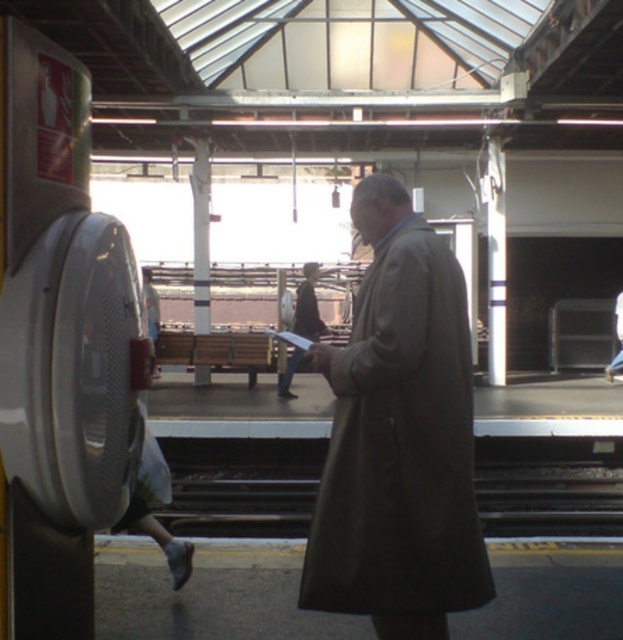
Is brown matte trench coat at center taller than dark gray metal train track at center?

Indeed, brown matte trench coat at center has a greater height compared to dark gray metal train track at center.

Between point (359, 349) and point (516, 477), which one is positioned behind?

The point (516, 477) is behind.

Find the location of a particular element. The width and height of the screenshot is (623, 640). brown matte trench coat at center is located at coordinates (397, 436).

In the scene shown: Does dark gray coat at center have a greater height compared to light brown leather coat at center?

Correct, dark gray coat at center is much taller as light brown leather coat at center.

You are a GUI agent. You are given a task and a screenshot of the screen. Output one action in this format:
    pyautogui.click(x=<x>, y=<y>)
    Task: Click on the dark gray coat at center
    This screenshot has height=640, width=623.
    Given the screenshot: What is the action you would take?
    pyautogui.click(x=307, y=305)

This screenshot has height=640, width=623. I want to click on dark gray coat at center, so click(x=307, y=305).

Who is higher up, brown matte trench coat at center or light brown leather coat at center?

light brown leather coat at center is above.

Can you confirm if brown matte trench coat at center is wider than light brown leather coat at center?

Indeed, brown matte trench coat at center has a greater width compared to light brown leather coat at center.

Which is behind, point (422, 372) or point (619, 362)?

Point (619, 362)

You are a GUI agent. You are given a task and a screenshot of the screen. Output one action in this format:
    pyautogui.click(x=<x>, y=<y>)
    Task: Click on the brown matte trench coat at center
    
    Given the screenshot: What is the action you would take?
    pyautogui.click(x=397, y=436)